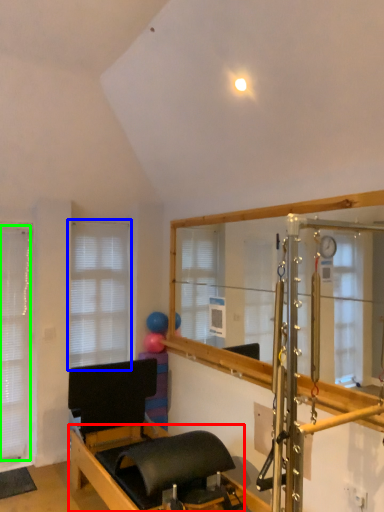
Question: Considering the real-world distances, which object is closest to bed frame (highlighted by a red box)? window (highlighted by a blue box) or blind (highlighted by a green box).

Choices:
 (A) window
 (B) blind

Answer: (B)